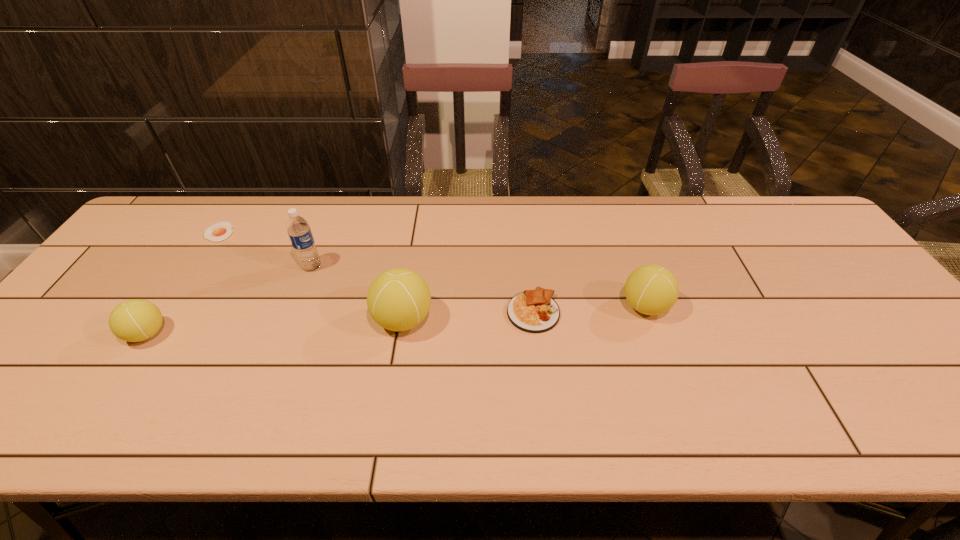
Considering the uniform spacing of tennis balls, where should an additional tennis ball be positioned on the right? Please locate a free spot. Please provide its 2D coordinates. Your answer should be formatted as a tuple, i.e. [(x, y)], where the tuple contains the x and y coordinates of a point satisfying the conditions above.

[(874, 294)]